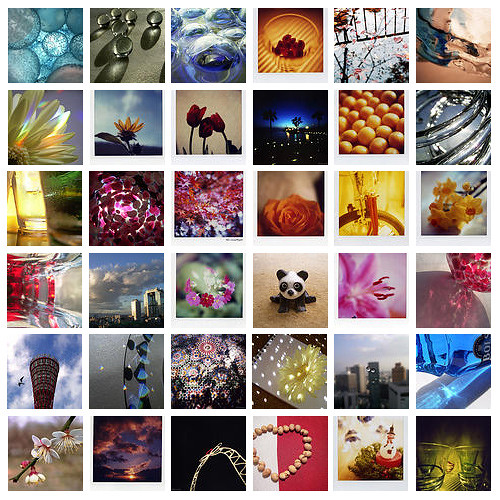
Where is `boxes in bottom row`? This screenshot has width=500, height=500. boxes in bottom row is located at coordinates (36, 470), (137, 449), (213, 446), (305, 450), (380, 451), (452, 446).